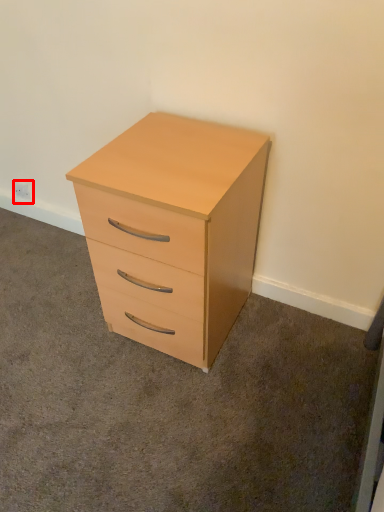
Question: From the image's perspective, where is electric outlet (annotated by the red box) located in relation to chest of drawers in the image?

Choices:
 (A) above
 (B) below

Answer: (A)